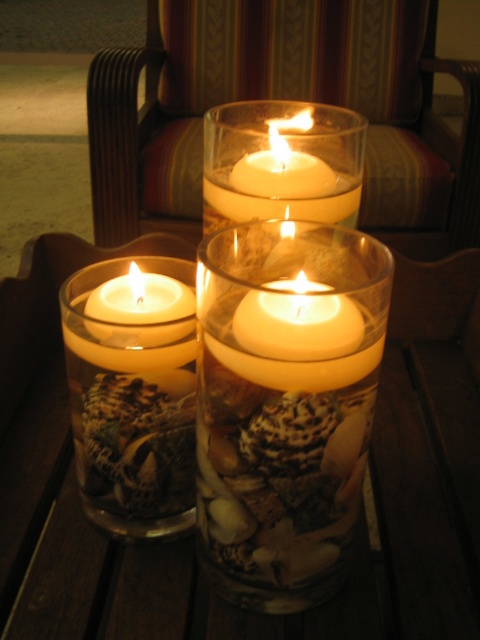
You are standing in a room with a wooden floor and want to place a new decorative item. The wooden armchair at upper center is located at point (288,99). If you want to place the item 2 meters away from the wooden armchair at upper center, where should you place it?

The wooden armchair at upper center is represented by point (288,99). To place the item 2 meters away from this point, you would need to calculate the coordinates based on the room dimensions and scale, but the exact placement depends on the room layout and direction chosen.

You are standing in front of the wooden surface with the three glass containers. The point marked as point (192, 538) corresponds to the translucent glass candle at center. Which container has the most seashells and stones at its base?

The container in the foreground has the most seashells and stones at its base.